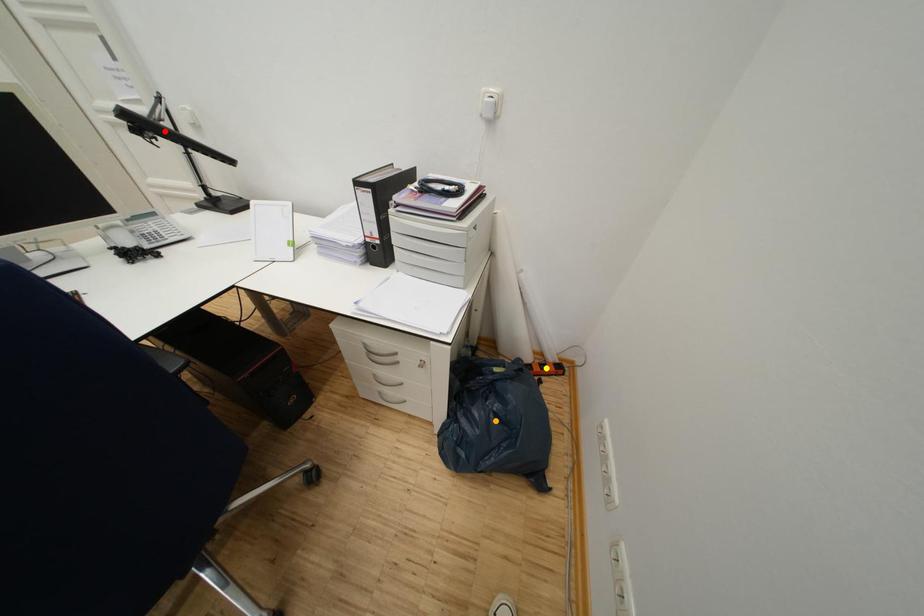
Based on the photo, order these from nearest to farthest:
A) yellow point
B) orange point
C) red point

red point, orange point, yellow point